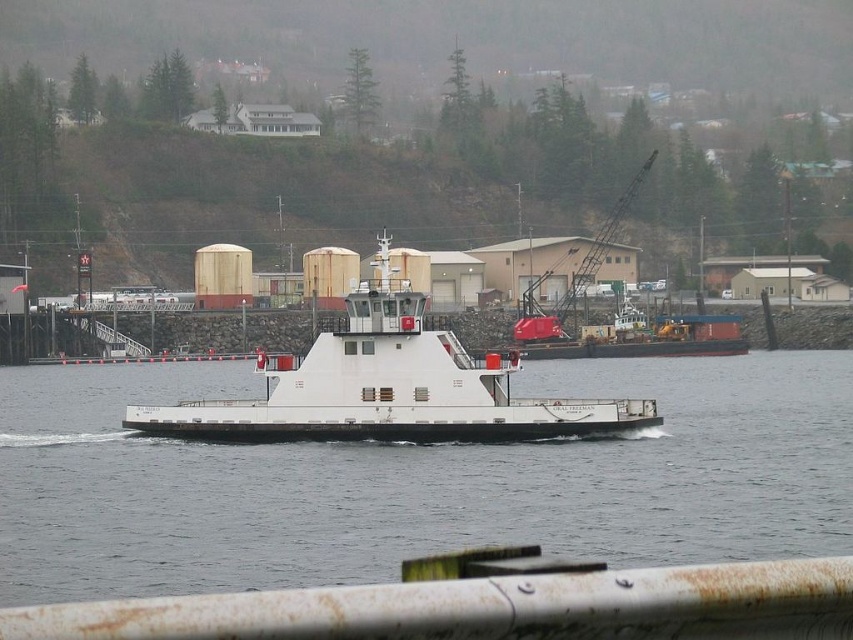
Is white matte water at center to the left of white matte boat at center from the viewer's perspective?

In fact, white matte water at center is to the right of white matte boat at center.

Does point (598, 371) lie in front of point (422, 406)?

No, (598, 371) is behind (422, 406).

The height and width of the screenshot is (640, 853). In order to click on white matte water at center in this screenshot , I will do `click(416, 481)`.